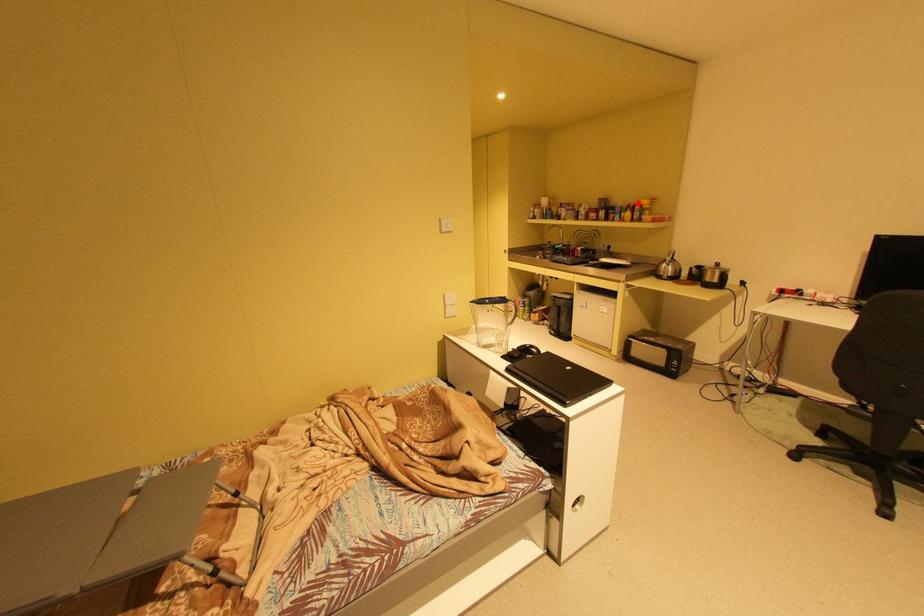
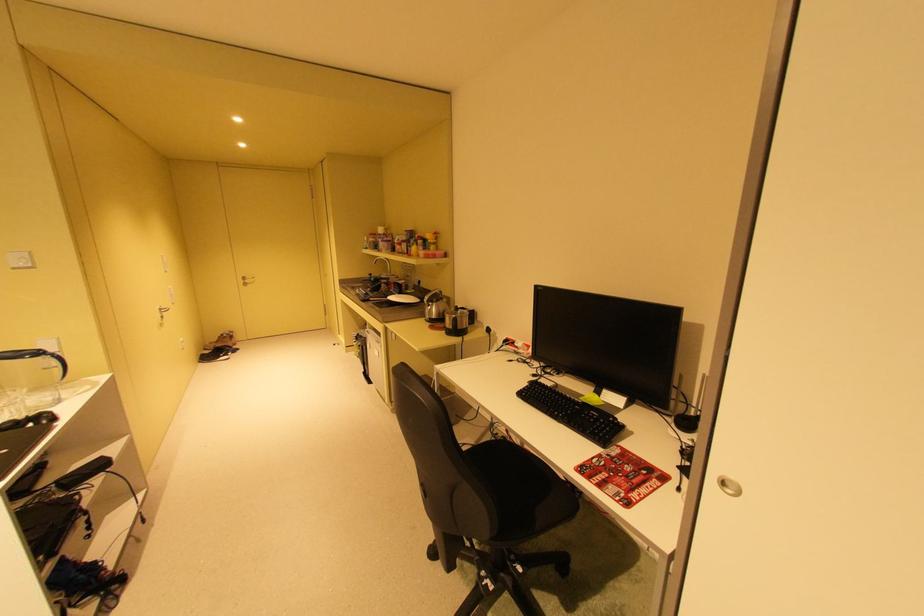
The point at the highlighted location is marked in the first image. Where is the corresponding point in the second image?

(428, 237)